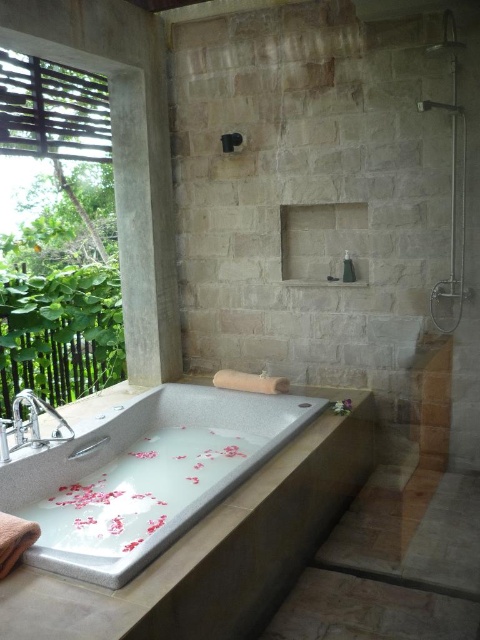
Question: Is matte gray showerhead at upper right positioned at the back of black rubber showerhead at upper center?

Choices:
 (A) no
 (B) yes

Answer: (A)

Question: Which point is farther to the camera?

Choices:
 (A) matte gray showerhead at upper right
 (B) black rubber showerhead at upper center

Answer: (B)

Question: Is silver metallic sink at left smaller than matte gray showerhead at upper right?

Choices:
 (A) no
 (B) yes

Answer: (A)

Question: Which object appears farthest from the camera in this image?

Choices:
 (A) matte gray showerhead at upper right
 (B) black rubber showerhead at upper center
 (C) silver metallic sink at left
 (D) white marble bathtub at center

Answer: (B)

Question: Is white marble bathtub at center thinner than matte gray showerhead at upper right?

Choices:
 (A) no
 (B) yes

Answer: (A)

Question: Which point is farther to the camera?

Choices:
 (A) white marble bathtub at center
 (B) black rubber showerhead at upper center

Answer: (B)